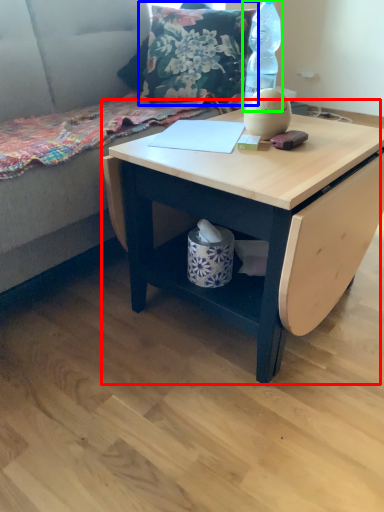
Question: Which object is positioned farthest from table (highlighted by a red box)? Select from throw pillow (highlighted by a blue box) and bottle (highlighted by a green box).

Choices:
 (A) throw pillow
 (B) bottle

Answer: (A)